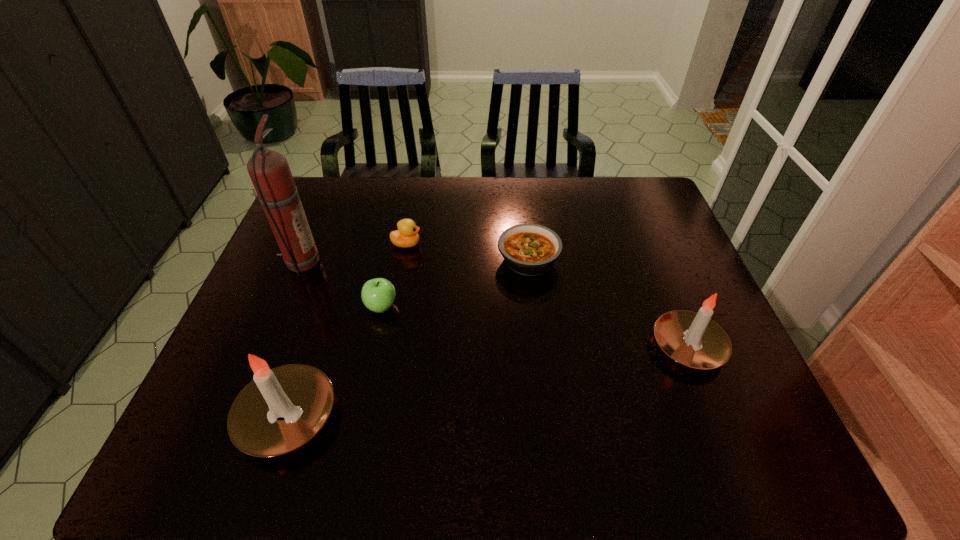
The height and width of the screenshot is (540, 960). I want to click on vacant area situated on the left of the rightmost object, so click(x=597, y=346).

Locate an element on the screen. Image resolution: width=960 pixels, height=540 pixels. vacant space located 0.140m on the face of the duckling is located at coordinates (468, 244).

In order to click on blank space located on the side of the tallest object with the label and nozzle in this screenshot , I will do `click(383, 263)`.

Where is `free space located 0.270m on the left of the apple`? The image size is (960, 540). free space located 0.270m on the left of the apple is located at coordinates (261, 307).

Locate an element on the screen. The width and height of the screenshot is (960, 540). vacant space located 0.060m on the right of the shortest object is located at coordinates (581, 260).

Where is `object located at the near edge`? Image resolution: width=960 pixels, height=540 pixels. object located at the near edge is located at coordinates (303, 395).

This screenshot has width=960, height=540. Find the location of `candle located at the left edge`. candle located at the left edge is located at coordinates (303, 395).

I want to click on fire extinguisher at the left edge, so click(x=269, y=171).

Identify the location of object situated at the right edge. (692, 339).

The height and width of the screenshot is (540, 960). Identify the location of object at the near left corner. (303, 395).